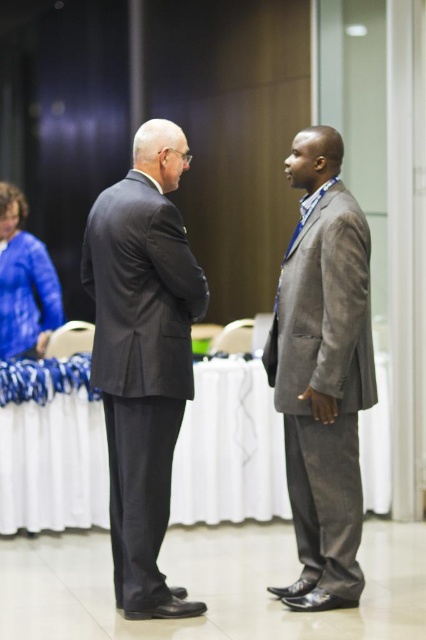
Question: Which point appears closest to the camera in this image?

Choices:
 (A) (161, 314)
 (B) (23, 218)

Answer: (A)

Question: Does dark gray suit at center have a smaller size compared to gray suit at center?

Choices:
 (A) yes
 (B) no

Answer: (B)

Question: Which point appears closest to the camera in this image?

Choices:
 (A) (331, 605)
 (B) (31, 340)
 (C) (146, 285)

Answer: (C)

Question: Observing the image, what is the correct spatial positioning of dark gray suit at center in reference to blue fabric jacket at upper left?

Choices:
 (A) left
 (B) right

Answer: (B)

Question: Is gray suit at center further to the viewer compared to blue fabric jacket at upper left?

Choices:
 (A) no
 (B) yes

Answer: (A)

Question: Which point is closer to the camera?

Choices:
 (A) blue fabric jacket at upper left
 (B) dark gray suit at center
 (C) gray suit at center

Answer: (B)